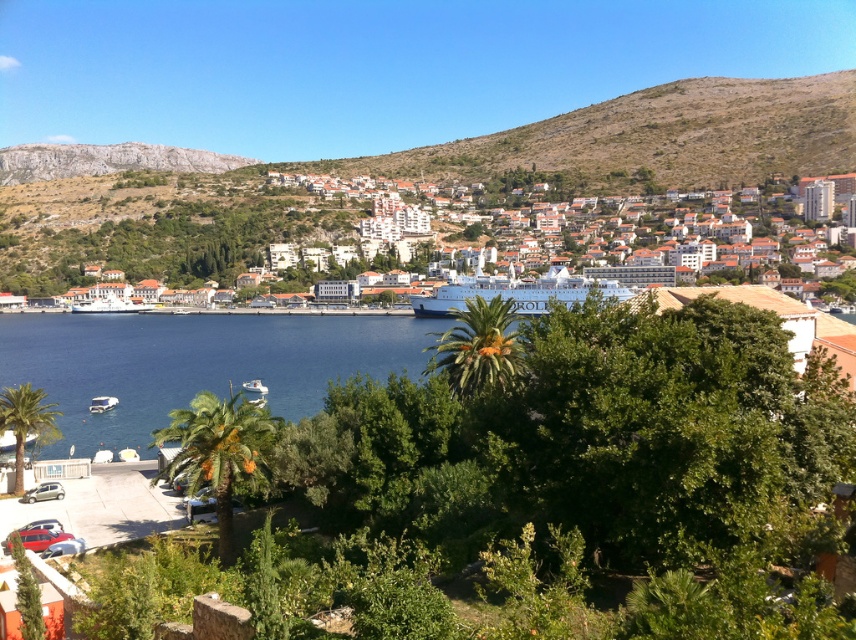
Can you confirm if white matte boat at lower left is positioned to the right of white glossy boat at lower left?

No, white matte boat at lower left is not to the right of white glossy boat at lower left.

Consider the image. Does white matte boat at lower left have a lesser width compared to white glossy boat at lower left?

Yes.

Where is `white matte boat at lower left`? white matte boat at lower left is located at coordinates (102, 403).

Consider the image. Which is above, blue water at center or white matte boat at lower left?

Positioned higher is blue water at center.

Who is positioned more to the right, blue water at center or white matte boat at lower left?

From the viewer's perspective, white matte boat at lower left appears more on the right side.

Describe the element at coordinates (193, 364) in the screenshot. This screenshot has width=856, height=640. I see `blue water at center` at that location.

This screenshot has width=856, height=640. What are the coordinates of `blue water at center` in the screenshot? It's located at (193, 364).

Describe the element at coordinates (654, 138) in the screenshot. I see `brown rocky hillside at center` at that location.

Can you confirm if brown rocky hillside at center is positioned to the right of white matte boat at lower left?

Indeed, brown rocky hillside at center is positioned on the right side of white matte boat at lower left.

Find the location of `brown rocky hillside at center`. brown rocky hillside at center is located at coordinates (654, 138).